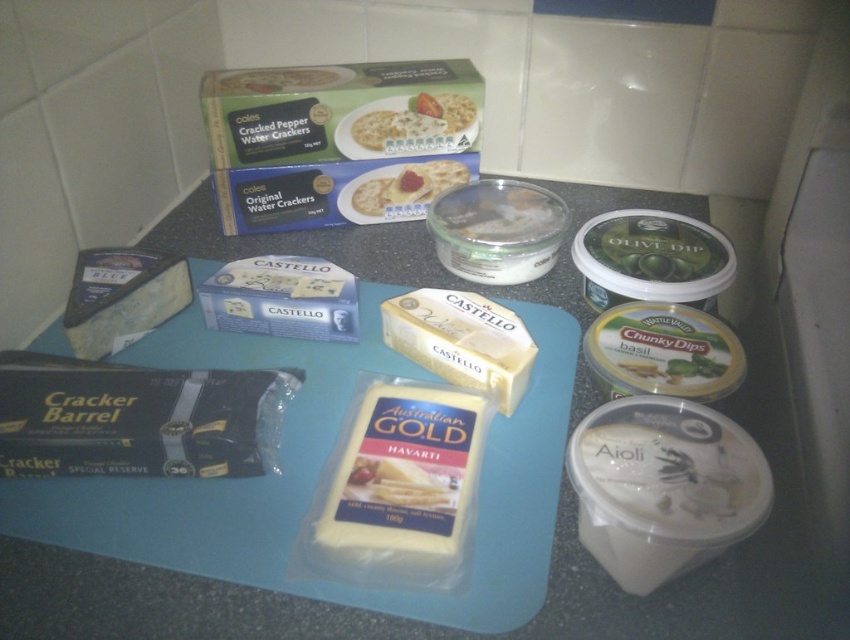
You are preparing a snack and have both the blue plastic cutting board at center and the matte white crackers at center on the counter. If you want to place a larger item on the counter, which object would be more suitable to use as a base?

The blue plastic cutting board at center is wider than the matte white crackers at center, so it would be more suitable to use as a base for a larger item.

You are standing in front of the food arrangement on the dark gray countertop. There are two points marked on the image at coordinates point (562, 531) and point (431, 131). Which point is closer to you?

Point (562, 531) is in front of point (431, 131), so it is closer to you.

You are arranging snacks for a party and have both the white cracker at upper center and the matte white crackers at center. Which one is shorter in height?

The white cracker at upper center is not as tall as the matte white crackers at center, so the white cracker at upper center is shorter in height.